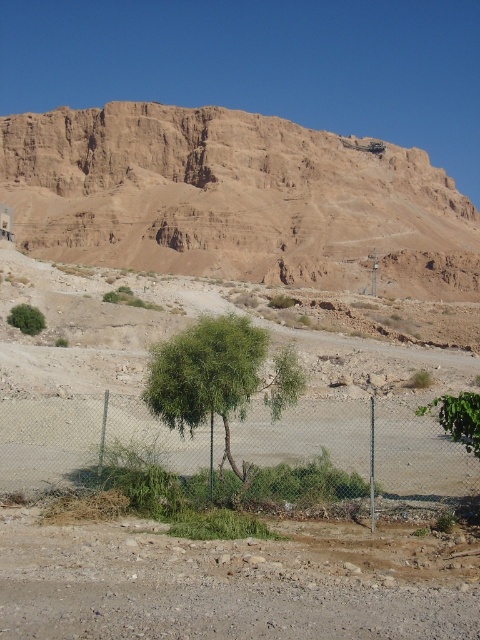
Question: Which object is positioned closest to the brown gravelly dirt field at lower center?

Choices:
 (A) metallic chain-link fence at center
 (B) green leafy bush at lower left
 (C) green leafy tree at center
 (D) green leafy bush at center

Answer: (A)

Question: Is green leafy bush at center further to camera compared to green leafy bush at lower left?

Choices:
 (A) yes
 (B) no

Answer: (B)

Question: Is the position of brown rocky mountain at upper center less distant than that of green leafy bush at center?

Choices:
 (A) yes
 (B) no

Answer: (B)

Question: Which object is farther from the camera taking this photo?

Choices:
 (A) green leafy tree at center
 (B) green leafy bush at center
 (C) metallic chain-link fence at center
 (D) brown rocky mountain at upper center

Answer: (D)

Question: Which object appears farthest from the camera in this image?

Choices:
 (A) green leafy bush at lower left
 (B) green leafy bush at center
 (C) brown gravelly dirt field at lower center
 (D) green leafy tree at center

Answer: (A)

Question: Can you confirm if brown gravelly dirt field at lower center is positioned to the left of green leafy tree at center?

Choices:
 (A) yes
 (B) no

Answer: (B)